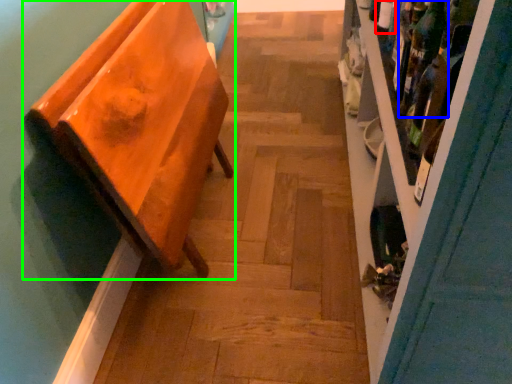
Question: Which object is positioned closest to bottle (highlighted by a red box)? Select from wine bottle (highlighted by a blue box) and furniture (highlighted by a green box).

Choices:
 (A) wine bottle
 (B) furniture

Answer: (A)